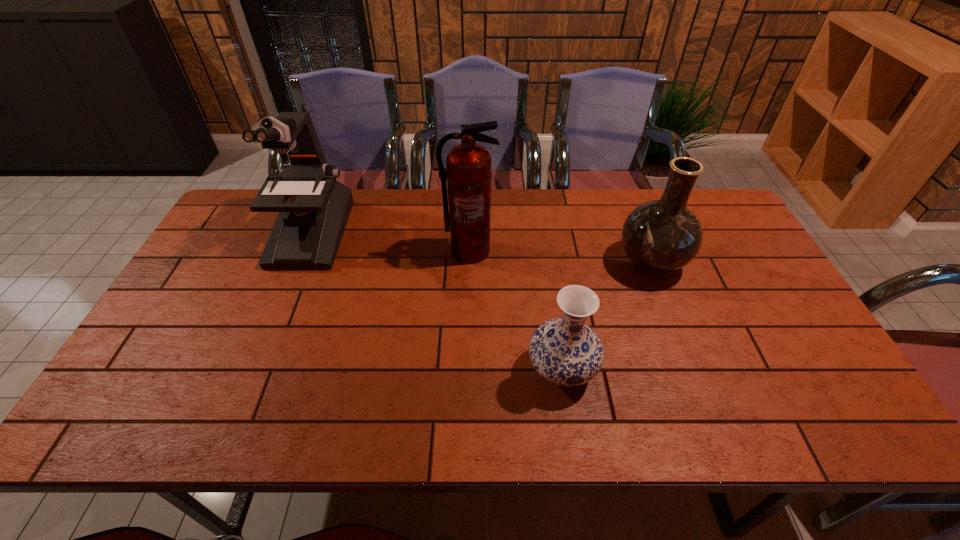
At what (x,y) coordinates should I click in order to perform the action: click on vacant space that satisfies the following two spatial constraints: 1. on the nozzle side of the second object from left to right; 2. on the left side of the nearer vase. Please return your answer as a coordinate pair (x, y). This screenshot has height=540, width=960. Looking at the image, I should click on (467, 369).

Where is `vacant space that satisfies the following two spatial constraints: 1. on the nozzle side of the right vase; 2. on the left side of the fire extinguisher`? vacant space that satisfies the following two spatial constraints: 1. on the nozzle side of the right vase; 2. on the left side of the fire extinguisher is located at coordinates (469, 262).

Where is `free region that satisfies the following two spatial constraints: 1. on the nozzle side of the right vase; 2. on the left side of the fire extinguisher`? free region that satisfies the following two spatial constraints: 1. on the nozzle side of the right vase; 2. on the left side of the fire extinguisher is located at coordinates (469, 262).

Locate an element on the screen. The image size is (960, 540). free space that satisfies the following two spatial constraints: 1. through the eyepieces of the shorter vase; 2. on the right side of the microscope is located at coordinates (254, 369).